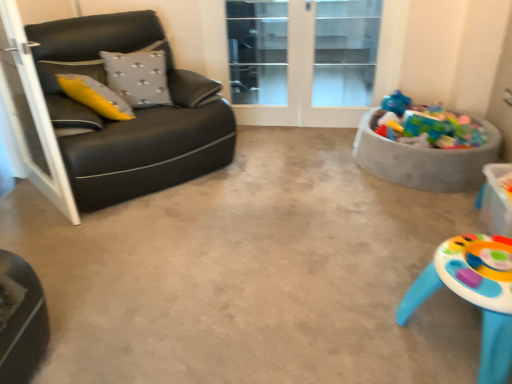
You are a GUI agent. You are given a task and a screenshot of the screen. Output one action in this format:
    pyautogui.click(x=<x>, y=<y>)
    Task: Click on the vacant space to the right of black leather couch at left
    The width and height of the screenshot is (512, 384).
    Given the screenshot: What is the action you would take?
    pyautogui.click(x=278, y=186)